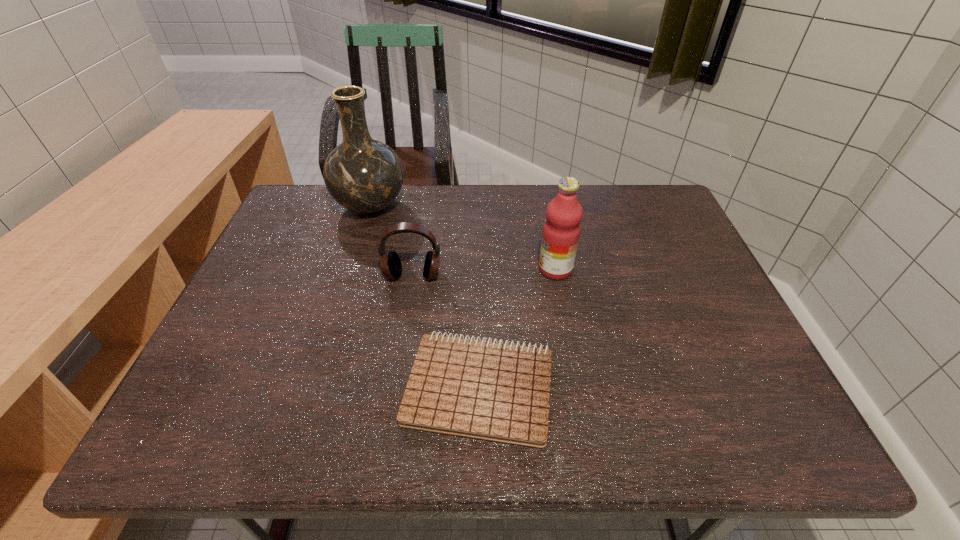
Identify the location of free area in between the rightmost object and the second shortest object. (484, 272).

You are a GUI agent. You are given a task and a screenshot of the screen. Output one action in this format:
    pyautogui.click(x=<x>, y=<y>)
    Task: Click on the vacant area that lies between the fruit juice and the headset
    The height and width of the screenshot is (540, 960).
    Given the screenshot: What is the action you would take?
    pyautogui.click(x=484, y=272)

What are the coordinates of `vacant area that lies between the fruit juice and the nearest object` in the screenshot? It's located at (517, 328).

Image resolution: width=960 pixels, height=540 pixels. What are the coordinates of `free space between the shortest object and the fruit juice` in the screenshot? It's located at (517, 328).

The width and height of the screenshot is (960, 540). Identify the location of vacant point located between the shortest object and the tallest object. (424, 297).

I want to click on vacant area that lies between the fruit juice and the notebook, so click(x=517, y=328).

The height and width of the screenshot is (540, 960). What are the coordinates of `free space that is in between the rightmost object and the farthest object` in the screenshot? It's located at (463, 238).

You are a GUI agent. You are given a task and a screenshot of the screen. Output one action in this format:
    pyautogui.click(x=<x>, y=<y>)
    Task: Click on the free spot between the second tallest object and the vase
    
    Given the screenshot: What is the action you would take?
    pyautogui.click(x=463, y=238)

Find the location of a particular element. blank region between the second shortest object and the tallest object is located at coordinates (392, 241).

The image size is (960, 540). Find the location of `free space between the nearest object and the third tallest object`. free space between the nearest object and the third tallest object is located at coordinates (446, 332).